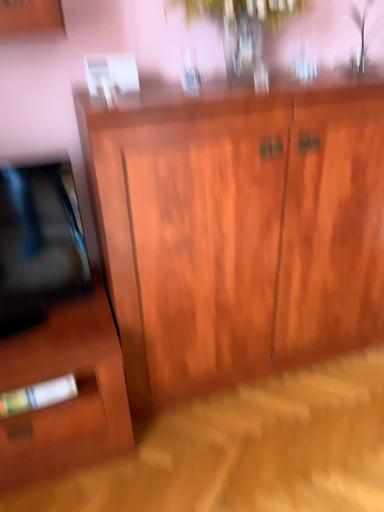
Question: Is wooden cabinet at center at the back of matte wood side cabinet at lower left?

Choices:
 (A) no
 (B) yes

Answer: (A)

Question: From a real-world perspective, is matte wood side cabinet at lower left on wooden cabinet at center?

Choices:
 (A) yes
 (B) no

Answer: (B)

Question: Does matte wood side cabinet at lower left have a larger size compared to wooden cabinet at center?

Choices:
 (A) yes
 (B) no

Answer: (B)

Question: Is there a large distance between matte wood side cabinet at lower left and wooden cabinet at center?

Choices:
 (A) no
 (B) yes

Answer: (A)

Question: Is matte wood side cabinet at lower left smaller than wooden cabinet at center?

Choices:
 (A) yes
 (B) no

Answer: (A)

Question: Is matte wood side cabinet at lower left surrounding wooden cabinet at center?

Choices:
 (A) no
 (B) yes

Answer: (A)

Question: Are wooden cabinet at center and matte wood side cabinet at lower left beside each other?

Choices:
 (A) no
 (B) yes

Answer: (A)

Question: From a real-world perspective, is wooden cabinet at center located higher than matte wood side cabinet at lower left?

Choices:
 (A) yes
 (B) no

Answer: (A)

Question: Is wooden cabinet at center taller than matte wood side cabinet at lower left?

Choices:
 (A) no
 (B) yes

Answer: (B)

Question: Is wooden cabinet at center behind matte wood side cabinet at lower left?

Choices:
 (A) yes
 (B) no

Answer: (B)

Question: Considering the relative positions of wooden cabinet at center and matte wood side cabinet at lower left in the image provided, is wooden cabinet at center to the left of matte wood side cabinet at lower left from the viewer's perspective?

Choices:
 (A) yes
 (B) no

Answer: (B)

Question: Considering the relative sizes of wooden cabinet at center and matte wood side cabinet at lower left in the image provided, is wooden cabinet at center thinner than matte wood side cabinet at lower left?

Choices:
 (A) yes
 (B) no

Answer: (A)

Question: Is matte wood side cabinet at lower left to the left or to the right of wooden cabinet at center in the image?

Choices:
 (A) left
 (B) right

Answer: (A)